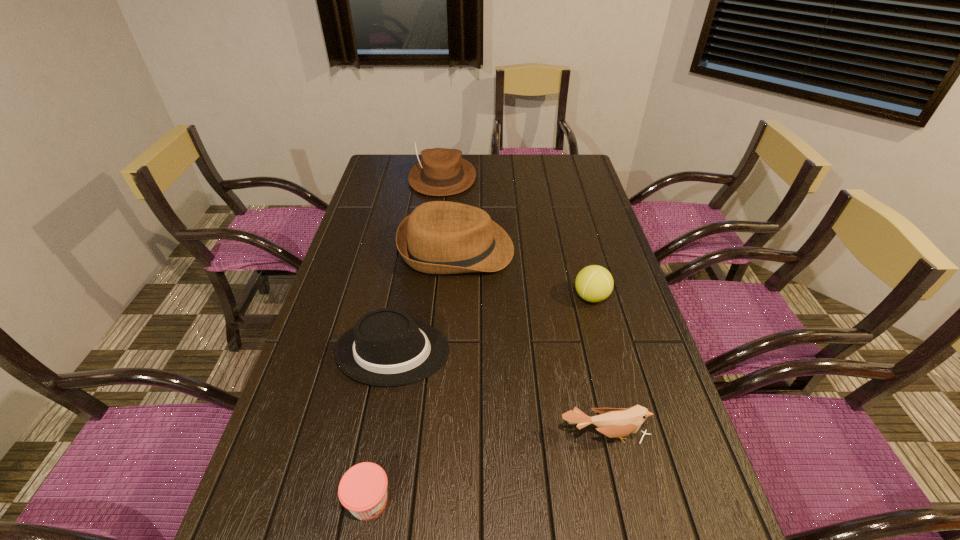
Find the location of a particular element. This screenshot has height=540, width=960. the farthest object is located at coordinates (442, 172).

Locate an element on the screen. the second farthest object is located at coordinates click(x=439, y=237).

Where is `the second tallest fedora`? the second tallest fedora is located at coordinates 439,237.

Where is `the nearest fedora`? This screenshot has width=960, height=540. the nearest fedora is located at coordinates (387, 347).

At what (x,y) coordinates should I click in order to perform the action: click on the third nearest object. Please return your answer as a coordinate pair (x, y). Looking at the image, I should click on (387, 347).

You are a GUI agent. You are given a task and a screenshot of the screen. Output one action in this format:
    pyautogui.click(x=<x>, y=<y>)
    Task: Click on the fourth nearest object
    This screenshot has width=960, height=540.
    Given the screenshot: What is the action you would take?
    pyautogui.click(x=594, y=283)

The height and width of the screenshot is (540, 960). Find the location of `bird`. bird is located at coordinates (612, 422).

You are a GUI agent. You are given a task and a screenshot of the screen. Output one action in this format:
    pyautogui.click(x=<x>, y=<y>)
    Task: Click on the shortest object
    The image size is (960, 540).
    Given the screenshot: What is the action you would take?
    pyautogui.click(x=362, y=490)

In order to click on jam in this screenshot , I will do `click(362, 490)`.

Image resolution: width=960 pixels, height=540 pixels. In order to click on free space located on the feather side of the farthest fedora in this screenshot , I will do `click(432, 263)`.